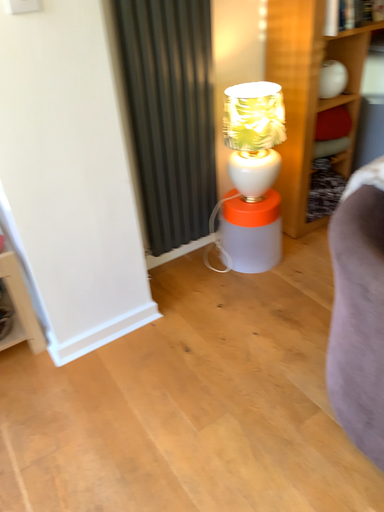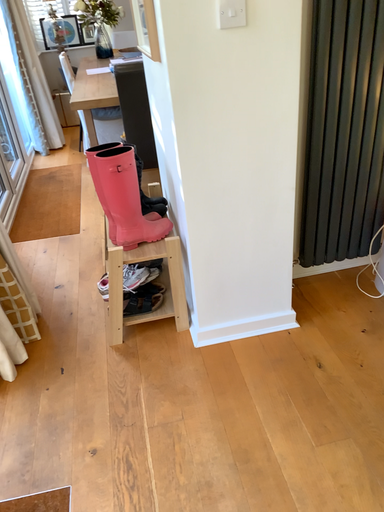
Question: How did the camera likely rotate when shooting the video?

Choices:
 (A) rotated right
 (B) rotated left

Answer: (B)